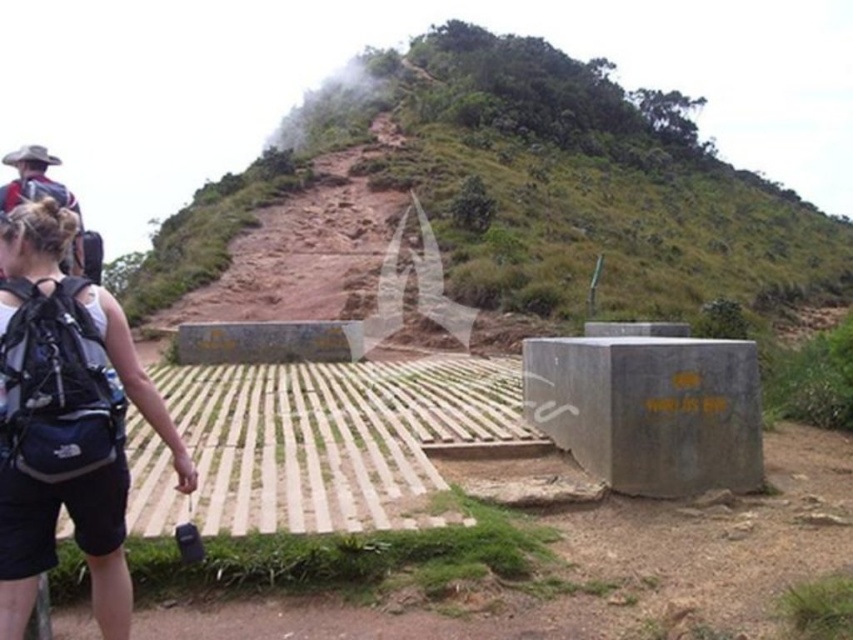
Can you confirm if brown dirt hillside at upper center is smaller than dark blue fabric backpack at lower left?

No.

Between brown dirt hillside at upper center and dark blue fabric backpack at lower left, which one is positioned higher?

brown dirt hillside at upper center is higher up.

The image size is (853, 640). I want to click on brown dirt hillside at upper center, so click(x=527, y=182).

This screenshot has width=853, height=640. I want to click on brown dirt hillside at upper center, so click(527, 182).